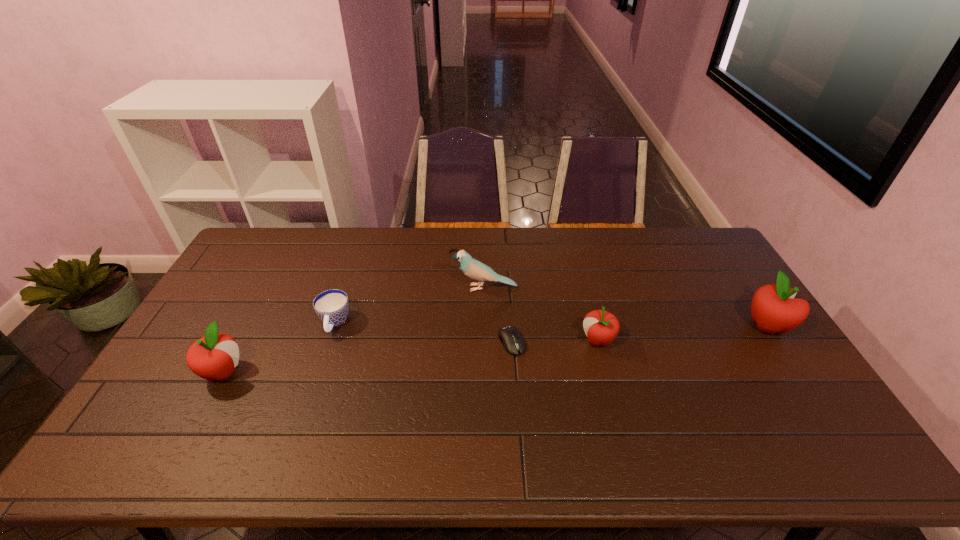
I want to click on the leftmost apple, so click(213, 357).

Find the location of a particular element. The image size is (960, 540). the leftmost object is located at coordinates (213, 357).

What are the coordinates of `the fifth object from left to right` in the screenshot? It's located at (601, 327).

Find the location of a particular element. the fourth tallest object is located at coordinates (601, 327).

At what (x,y) coordinates should I click in order to perform the action: click on the rightmost object. Please return your answer as a coordinate pair (x, y). This screenshot has width=960, height=540. Looking at the image, I should click on (773, 308).

Find the location of a particular element. Image resolution: width=960 pixels, height=540 pixels. bird is located at coordinates (471, 267).

You are a GUI agent. You are given a task and a screenshot of the screen. Output one action in this format:
    pyautogui.click(x=<x>, y=<y>)
    Task: Click on the shortest object
    
    Given the screenshot: What is the action you would take?
    pyautogui.click(x=510, y=337)

At what (x,y) coordinates should I click in order to perform the action: click on the fifth object from right to left. Please return your answer as a coordinate pair (x, y). Looking at the image, I should click on (332, 306).

At what (x,y) coordinates should I click in order to perform the action: click on cup. Please return your answer as a coordinate pair (x, y). Looking at the image, I should click on (332, 306).

In order to click on vacant space located 0.330m on the back of the leftmost object in this screenshot , I will do `click(273, 279)`.